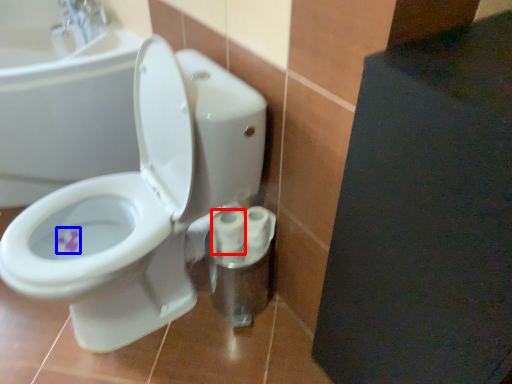
Question: Among these objects, which one is farthest to the camera, toilet paper (highlighted by a red box) or flower (highlighted by a blue box)?

Choices:
 (A) toilet paper
 (B) flower

Answer: (B)